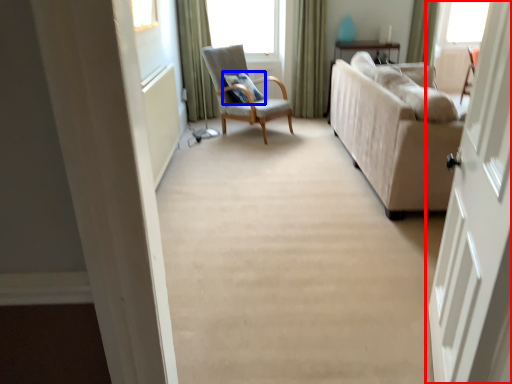
Question: Among these objects, which one is farthest to the camera, door (highlighted by a red box) or pillow (highlighted by a blue box)?

Choices:
 (A) door
 (B) pillow

Answer: (B)